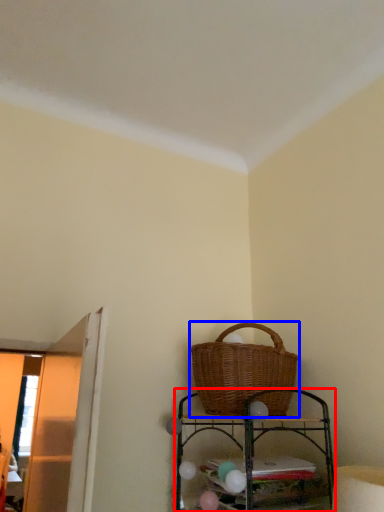
Question: Which object appears closest to the camera in this image, shelf (highlighted by a red box) or picnic basket (highlighted by a blue box)?

Choices:
 (A) shelf
 (B) picnic basket

Answer: (A)